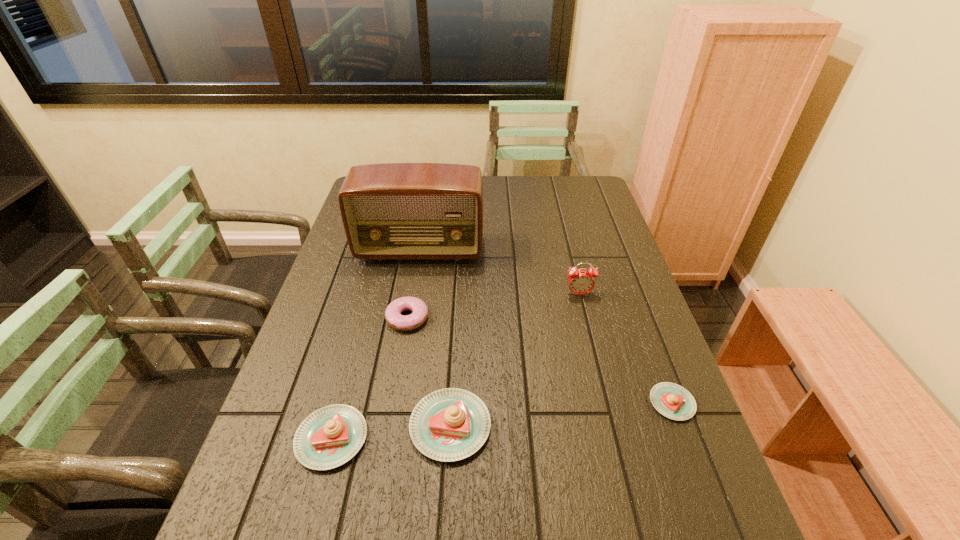
Find the location of a particular element. This screenshot has width=960, height=540. vacant area between the doughnut and the second pastry from right to left is located at coordinates (429, 372).

Where is `vacant area between the second pastry from right to left and the farthest object`? The width and height of the screenshot is (960, 540). vacant area between the second pastry from right to left and the farthest object is located at coordinates (435, 338).

Locate an element on the screen. The image size is (960, 540). empty location between the second pastry from right to left and the farthest object is located at coordinates (435, 338).

Image resolution: width=960 pixels, height=540 pixels. Find the location of `empty space between the shortest pastry and the farthest object`. empty space between the shortest pastry and the farthest object is located at coordinates (546, 327).

The image size is (960, 540). I want to click on free area in between the second pastry from right to left and the second tallest object, so click(x=515, y=360).

The height and width of the screenshot is (540, 960). Find the location of `empty space between the tallest object and the rightmost pastry`. empty space between the tallest object and the rightmost pastry is located at coordinates (546, 327).

I want to click on vacant space that's between the shortest pastry and the leftmost pastry, so click(502, 421).

Identify the location of the third closest object to the radio receiver. (451, 424).

Identify which object is the nearest to the farthest object. Please provide its 2D coordinates. Your answer should be formatted as a tuple, i.e. [(x, y)], where the tuple contains the x and y coordinates of a point satisfying the conditions above.

[(393, 316)]

Where is `pastry that stands as the closest to the third shortest object`? The width and height of the screenshot is (960, 540). pastry that stands as the closest to the third shortest object is located at coordinates (451, 424).